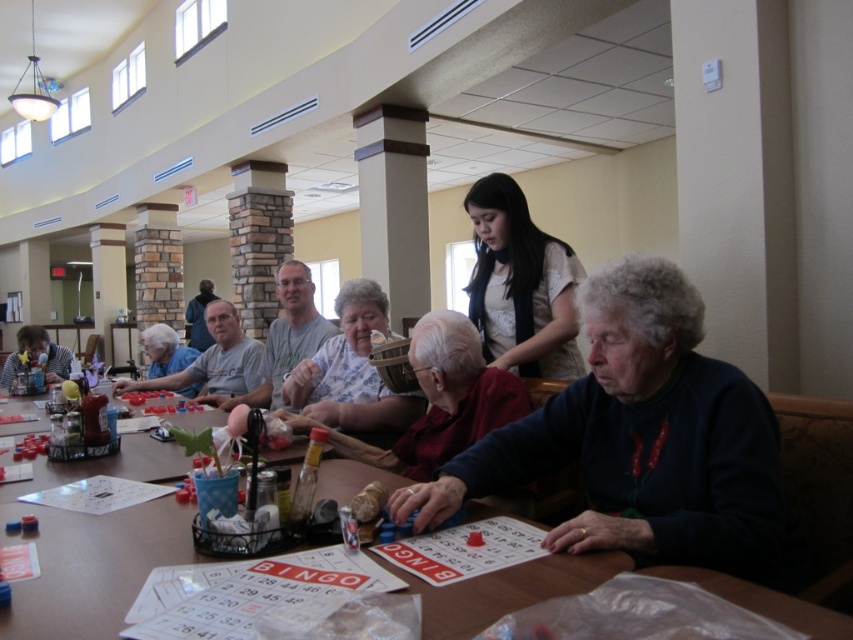
You are a photographer standing at the back of the room. You want to take a photo that includes both the white lace blouse at upper center and the gray fabric shirt at center. What is the minimum distance you need to move forward to ensure both are in frame?

The white lace blouse at upper center and the gray fabric shirt at center are 4.87 feet apart. To capture both in the frame, you need to move forward until your camera can encompass a distance of at least 4.87 feet between them, ensuring both are visible.

You are standing at the entrance of the Bingo hall and see two points marked in the room. The first point is at coordinates point (514, 244) and the second is at point (256, 372). If you want to reach the point that is closer to you, which coordinate should you aim for?

Point (514, 244) is in front of point (256, 372), so it is closer to you. Therefore, you should aim for point (514, 244).